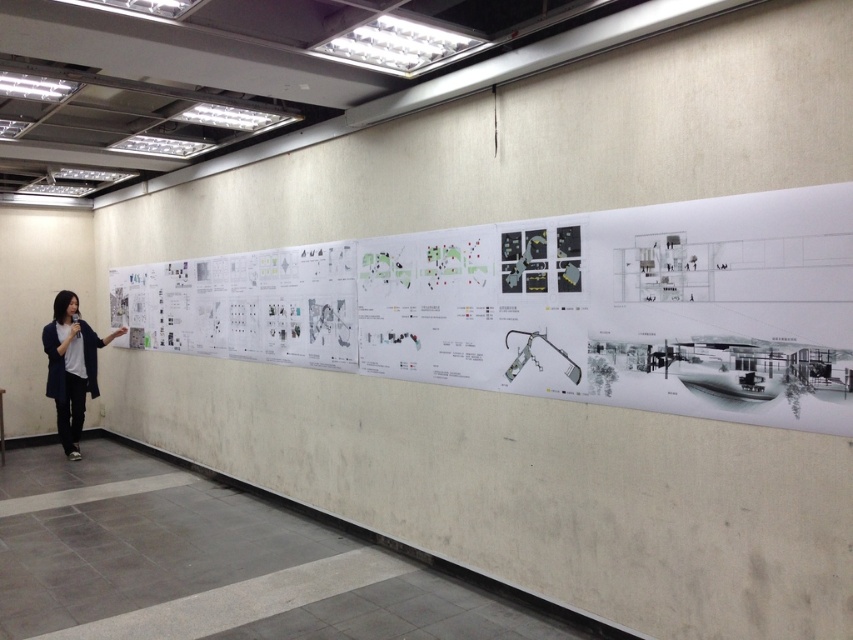
You are an attendee at a presentation and want to take a photo of the white paper at center and the dark blue fabric jacket at left. Which object should you focus on first to ensure both are in frame?

The white paper at center has a lesser height compared to dark blue fabric jacket at left, so focus on the dark blue fabric jacket at left first to ensure both are in frame.

You are an attendee at a presentation and want to take notes on the white paper at center. Can you reach it while standing next to the dark blue fabric jacket at left?

The white paper at center is above the dark blue fabric jacket at left, so you can reach it by standing on the jacket or using a stool.

You are an attendee at a presentation and want to take a photo of the white paper at center and the dark blue fabric jacket at left. Which object should you focus on first to ensure both are in the frame?

You should focus on the white paper at center first because it is closer to the viewer than the dark blue fabric jacket at left, ensuring both are in focus when taking the photo.